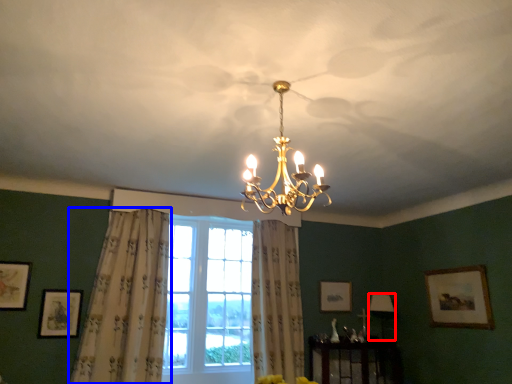
Question: Which of the following is the closest to the observer, lamp (highlighted by a red box) or curtain (highlighted by a blue box)?

Choices:
 (A) lamp
 (B) curtain

Answer: (B)